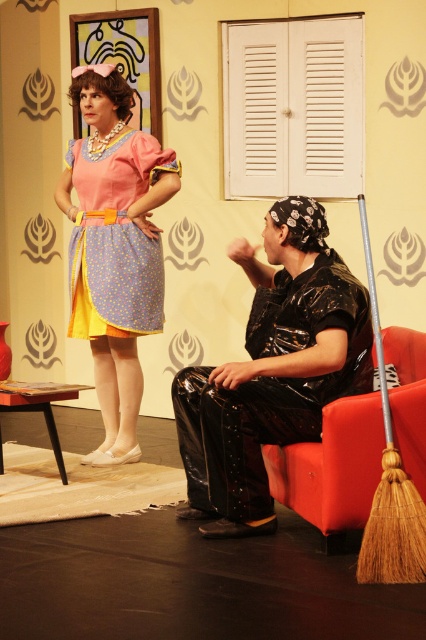
You are an actor in a play and need to exit the stage quickly. You see the shiny black pants at lower right and the rubberized black armchair at lower right. Which object is closer to you, and why?

The shiny black pants at lower right are closer to you because they are positioned further to the viewer than the rubberized black armchair at lower right, meaning the pants are nearer in the scene.

Based on the photo, you are a stagehand preparing to adjust the lighting for the performance. You need to position a spotlight so it can illuminate the matte pink dress at upper left without affecting other parts of the stage. Considering the distance from the camera, what is the minimum distance the spotlight should be placed from the dress to ensure it only lights up the dress?

The matte pink dress at upper left is 14.70 feet from the camera. To ensure the spotlight only illuminates the dress and not other areas, the spotlight should be placed at least 14.70 feet away from the dress.